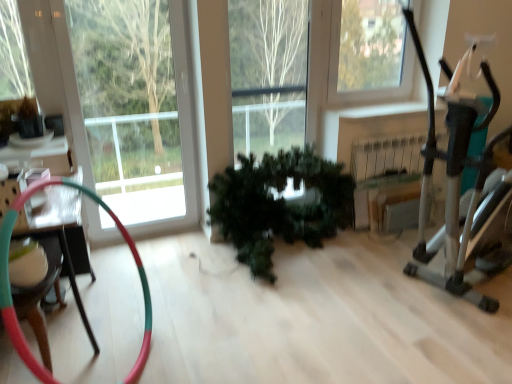
Question: Is multicolored rubber hose at left closer to camera compared to green matte plant at center?

Choices:
 (A) no
 (B) yes

Answer: (B)

Question: Considering the relative sizes of multicolored rubber hose at left and green matte plant at center in the image provided, is multicolored rubber hose at left thinner than green matte plant at center?

Choices:
 (A) no
 (B) yes

Answer: (B)

Question: From a real-world perspective, is multicolored rubber hose at left positioned under green matte plant at center based on gravity?

Choices:
 (A) yes
 (B) no

Answer: (B)

Question: Is multicolored rubber hose at left placed right next to green matte plant at center?

Choices:
 (A) no
 (B) yes

Answer: (A)

Question: Is multicolored rubber hose at left not close to green matte plant at center?

Choices:
 (A) yes
 (B) no

Answer: (A)

Question: Considering the positions of clear glass window at upper right and metallic silver exercise machine at right in the image, is clear glass window at upper right taller or shorter than metallic silver exercise machine at right?

Choices:
 (A) tall
 (B) short

Answer: (B)

Question: Is clear glass window at upper right spatially inside metallic silver exercise machine at right, or outside of it?

Choices:
 (A) outside
 (B) inside

Answer: (A)

Question: In terms of width, does clear glass window at upper right look wider or thinner when compared to metallic silver exercise machine at right?

Choices:
 (A) wide
 (B) thin

Answer: (B)

Question: From the image's perspective, relative to metallic silver exercise machine at right, is clear glass window at upper right above or below?

Choices:
 (A) above
 (B) below

Answer: (A)

Question: In terms of height, does metallic silver exercise machine at right look taller or shorter compared to green matte plant at center?

Choices:
 (A) short
 (B) tall

Answer: (B)

Question: Is metallic silver exercise machine at right wider or thinner than green matte plant at center?

Choices:
 (A) wide
 (B) thin

Answer: (A)

Question: Considering the positions of point (443, 155) and point (279, 165), is point (443, 155) closer or farther from the camera than point (279, 165)?

Choices:
 (A) farther
 (B) closer

Answer: (B)

Question: From a real-world perspective, relative to green matte plant at center, is metallic silver exercise machine at right vertically above or below?

Choices:
 (A) above
 (B) below

Answer: (A)

Question: Is green matte plant at center wider or thinner than clear glass window at upper right?

Choices:
 (A) thin
 (B) wide

Answer: (B)

Question: Is green matte plant at center taller or shorter than clear glass window at upper right?

Choices:
 (A) tall
 (B) short

Answer: (B)